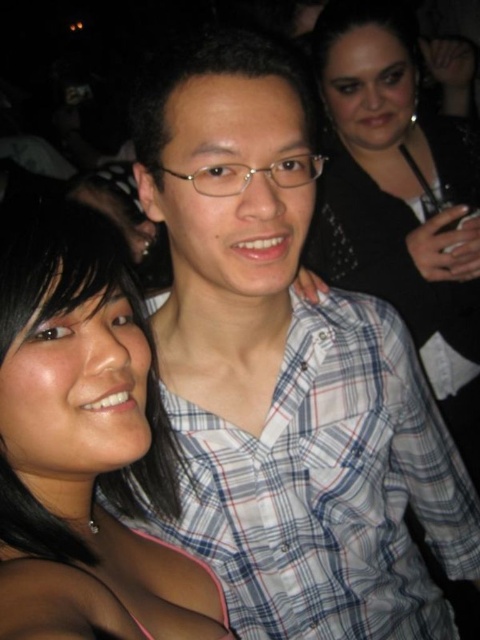
Does white checkered shirt at center have a greater width compared to black matte hair at center?

Yes.

I want to click on white checkered shirt at center, so click(328, 486).

Is point (207, 470) in front of point (6, 474)?

No, (207, 470) is behind (6, 474).

The width and height of the screenshot is (480, 640). I want to click on white checkered shirt at center, so click(x=328, y=486).

From the picture: Between white checkered shirt at center and black sequined dress at upper right, which one is positioned higher?

black sequined dress at upper right

Does white checkered shirt at center have a smaller size compared to black sequined dress at upper right?

Correct, white checkered shirt at center occupies less space than black sequined dress at upper right.

Image resolution: width=480 pixels, height=640 pixels. In order to click on white checkered shirt at center in this screenshot , I will do `click(328, 486)`.

Locate an element on the screen. The height and width of the screenshot is (640, 480). white checkered shirt at center is located at coordinates (328, 486).

This screenshot has height=640, width=480. What are the coordinates of `black matte hair at center` in the screenshot? It's located at (84, 444).

Is black matte hair at center thinner than black sequined dress at upper right?

Indeed, black matte hair at center has a lesser width compared to black sequined dress at upper right.

Does point (220, 630) lie behind point (348, 180)?

No, (220, 630) is closer to viewer.

Where is `black matte hair at center`? The image size is (480, 640). black matte hair at center is located at coordinates (84, 444).